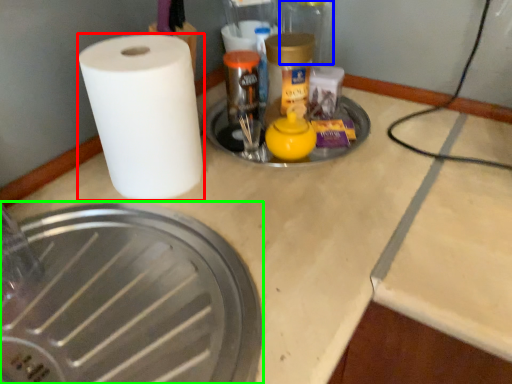
Question: Estimate the real-world distances between objects in this image. Which object is closer to paper towel (highlighted by a red box), glass jar (highlighted by a blue box) or manhole cover (highlighted by a green box)?

Choices:
 (A) glass jar
 (B) manhole cover

Answer: (B)